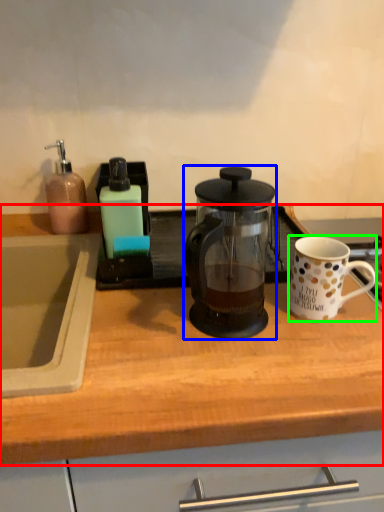
Question: Which object is positioned closest to countertop (highlighted by a red box)? Select from kettle (highlighted by a blue box) and coffee cup (highlighted by a green box).

Choices:
 (A) kettle
 (B) coffee cup

Answer: (A)